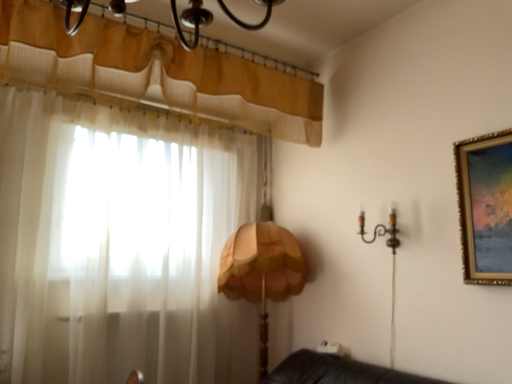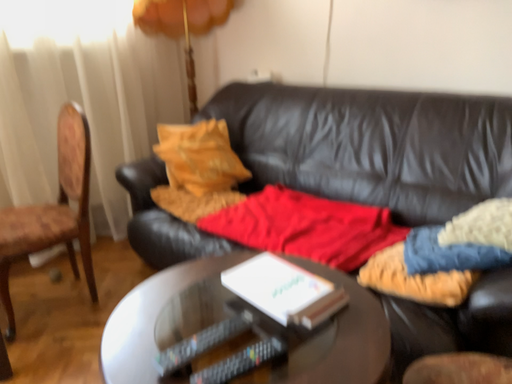
Question: How did the camera likely rotate when shooting the video?

Choices:
 (A) rotated upward
 (B) rotated downward

Answer: (B)